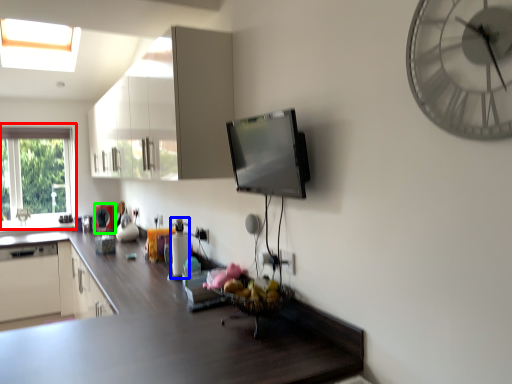
Question: Based on their relative distances, which object is nearer to window (highlighted by a red box)? Choose from appliance (highlighted by a blue box) and appliance (highlighted by a green box).

Choices:
 (A) appliance
 (B) appliance

Answer: (B)